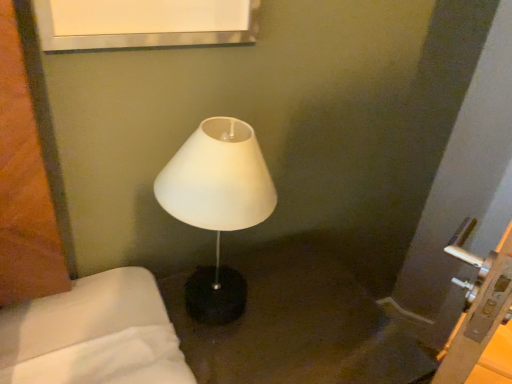
Find the location of a particular element. Image resolution: width=512 pixels, height=384 pixels. white matte lamp at center is located at coordinates (217, 206).

Describe the element at coordinates (217, 206) in the screenshot. I see `white matte lamp at center` at that location.

What is the approximate width of white matte lamp at center?

It is 10.85 inches.

The width and height of the screenshot is (512, 384). What are the coordinates of `white matte lamp at center` in the screenshot? It's located at (217, 206).